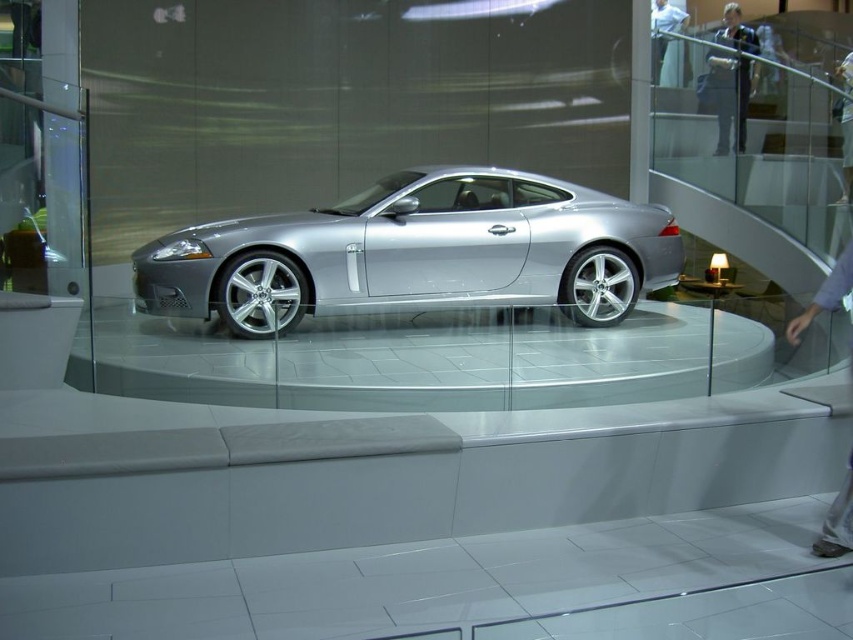
You are standing at the point [740,131] in the showroom. You want to walk to the entrance located at the opposite corner of the showroom. The shortest path requires you to walk 9.34 meters. Is this distance sufficient to reach the entrance without deviating from your path?

The distance between the point [740,131] and the entrance is 9.34 meters. Since the shortest path is exactly 9.34 meters, you can reach the entrance without deviating from your path.

You are a photographer planning to take a portrait of the dark blue suit at upper right and the light blue shirt at upper center in the showroom. To ensure both subjects are in frame, should you position yourself to the left or right of the car platform?

You should position yourself to the right of the car platform because the dark blue suit at upper right is on the left side of the light blue shirt at upper center, so placing yourself to the right would allow both subjects to be captured within the frame.